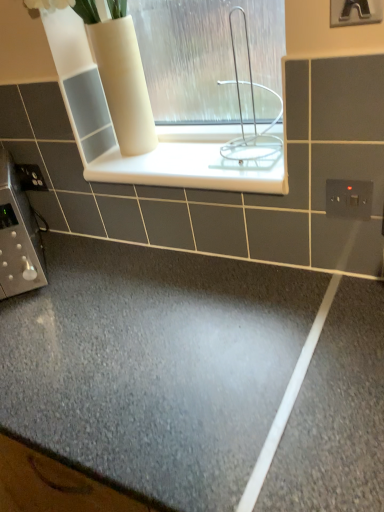
Question: Does white wire rack at center appear on the right side of satin silver switch at lower left, the first electric outlet in the back-to-front sequence?

Choices:
 (A) no
 (B) yes

Answer: (B)

Question: Is white wire rack at center outside of satin silver switch at lower left, the first electric outlet from the left?

Choices:
 (A) yes
 (B) no

Answer: (A)

Question: Is white wire rack at center behind satin silver switch at lower left, which ranks as the 2th electric outlet in bottom-to-top order?

Choices:
 (A) yes
 (B) no

Answer: (B)

Question: Is white wire rack at center smaller than satin silver switch at lower left, the 2th electric outlet in the front-to-back sequence?

Choices:
 (A) no
 (B) yes

Answer: (A)

Question: Is white wire rack at center positioned before satin silver switch at lower left, the second electric outlet positioned from the right?

Choices:
 (A) no
 (B) yes

Answer: (B)

Question: Is white wire rack at center directly adjacent to satin silver switch at lower left, the second electric outlet positioned from the right?

Choices:
 (A) yes
 (B) no

Answer: (B)

Question: Is satin silver switch at lower left, marked as the first electric outlet in a top-to-bottom arrangement, far away from white glossy ledge at center?

Choices:
 (A) yes
 (B) no

Answer: (B)

Question: Can you confirm if satin silver switch at lower left, the first electric outlet from the left, is thinner than white glossy ledge at center?

Choices:
 (A) no
 (B) yes

Answer: (B)

Question: Does satin silver switch at lower left, the first electric outlet in the back-to-front sequence, come in front of white glossy ledge at center?

Choices:
 (A) no
 (B) yes

Answer: (A)

Question: Would you say white glossy ledge at center is part of satin silver switch at lower left, the second electric outlet positioned from the right,'s contents?

Choices:
 (A) yes
 (B) no

Answer: (B)

Question: From the image's perspective, is satin silver switch at lower left, the first electric outlet in the back-to-front sequence, below white glossy ledge at center?

Choices:
 (A) no
 (B) yes

Answer: (B)

Question: Is satin silver switch at lower left, the first electric outlet from the left, turned away from white glossy ledge at center?

Choices:
 (A) no
 (B) yes

Answer: (A)

Question: Is white plastic electric outlet at upper right, which ranks as the 1th electric outlet in right-to-left order, next to white glossy ledge at center and touching it?

Choices:
 (A) no
 (B) yes

Answer: (A)